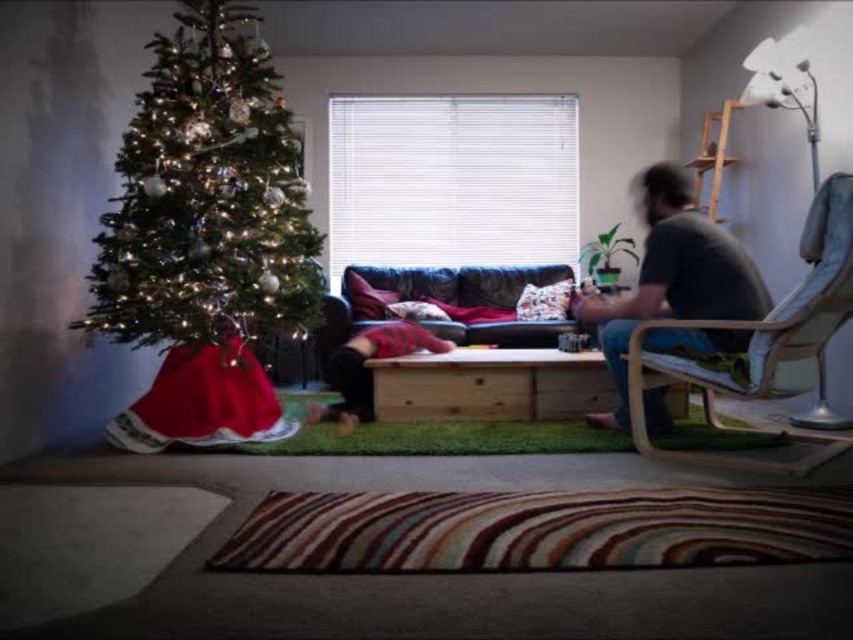
Question: Estimate the real-world distances between objects in this image. Which object is closer to the leather couch at center?

Choices:
 (A) striped sweater at center
 (B) gray matte shirt at right
 (C) light brown wood armchair at right
 (D) green matte christmas tree at left

Answer: (A)

Question: Is green matte christmas tree at left closer to the viewer compared to gray matte shirt at right?

Choices:
 (A) no
 (B) yes

Answer: (A)

Question: Which object is closer to the camera taking this photo?

Choices:
 (A) gray matte shirt at right
 (B) leather couch at center

Answer: (A)

Question: Which point appears closest to the camera in this image?

Choices:
 (A) (346, 340)
 (B) (547, 278)

Answer: (A)

Question: Is leather couch at center above striped sweater at center?

Choices:
 (A) no
 (B) yes

Answer: (B)

Question: Does light brown wood armchair at right appear over gray matte shirt at right?

Choices:
 (A) yes
 (B) no

Answer: (B)